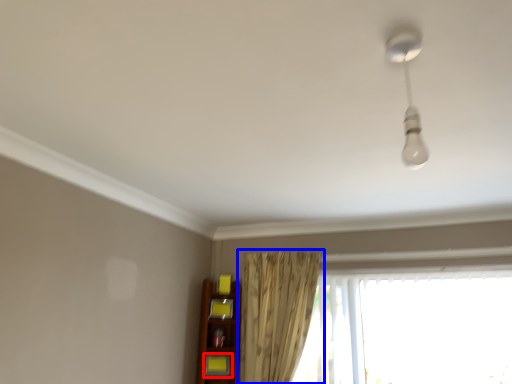
Question: Among these objects, which one is nearest to the camera, shelf (highlighted by a red box) or curtain (highlighted by a blue box)?

Choices:
 (A) shelf
 (B) curtain

Answer: (B)